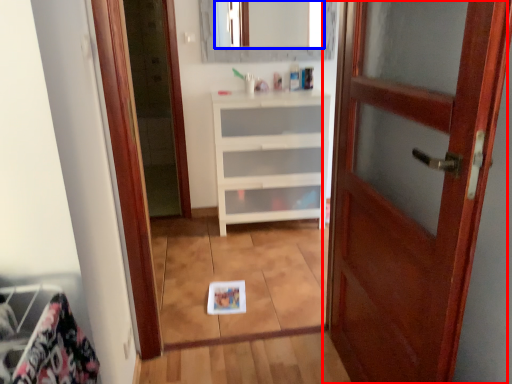
Question: Which point is further to the camera, door (highlighted by a red box) or mirror (highlighted by a blue box)?

Choices:
 (A) door
 (B) mirror

Answer: (B)